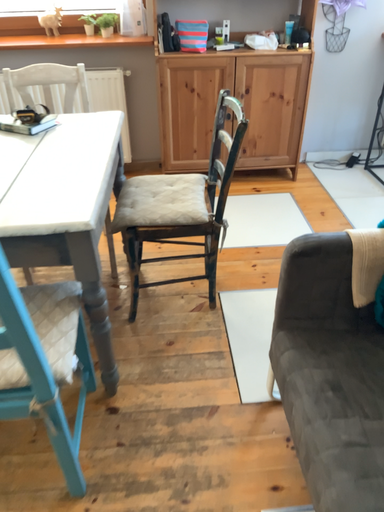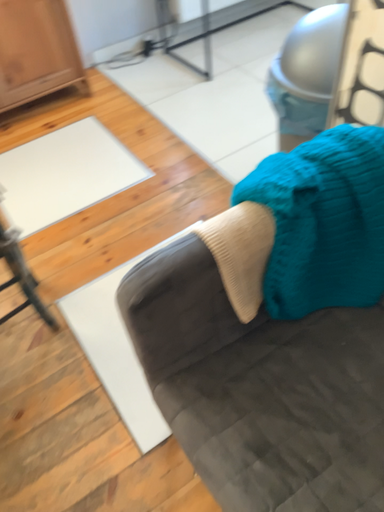
Question: How did the camera likely rotate when shooting the video?

Choices:
 (A) rotated left
 (B) rotated right

Answer: (B)